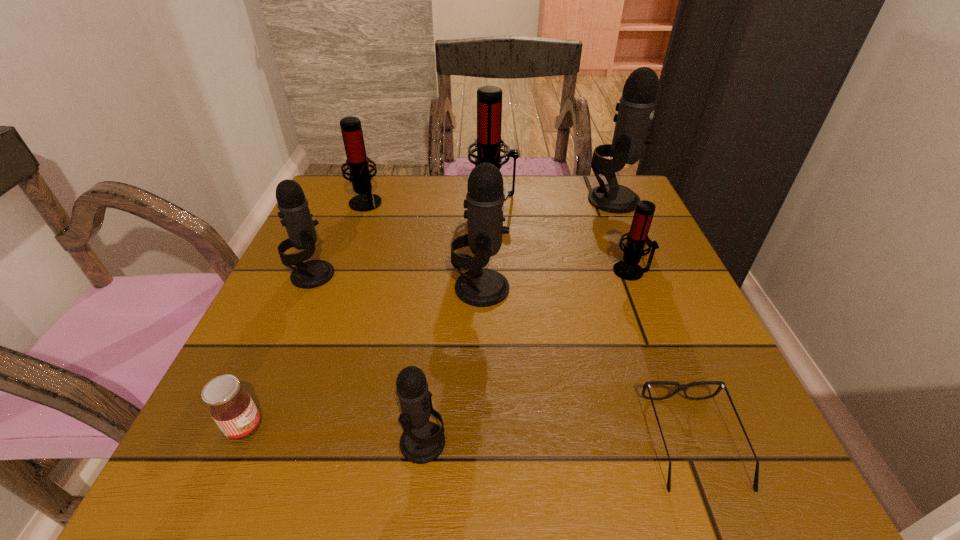
Where is `the closest red microphone to the spectacles`? The width and height of the screenshot is (960, 540). the closest red microphone to the spectacles is located at coordinates (628, 269).

You are a GUI agent. You are given a task and a screenshot of the screen. Output one action in this format:
    pyautogui.click(x=<x>, y=<y>)
    Task: Click on the red microphone that stands as the closest to the biggest black microphone
    
    Given the screenshot: What is the action you would take?
    pyautogui.click(x=489, y=98)

The image size is (960, 540). I want to click on free space that satisfies the following two spatial constraints: 1. on the front side of the second biggest black microphone; 2. on the label side of the second shortest object, so click(x=481, y=427).

The width and height of the screenshot is (960, 540). I want to click on vacant region that satisfies the following two spatial constraints: 1. on the back side of the nearest black microphone; 2. on the right side of the tallest object, so (448, 200).

Where is `free spot that satisfies the following two spatial constraints: 1. on the front side of the second red microphone from right to left; 2. on the label side of the second shortest object`? free spot that satisfies the following two spatial constraints: 1. on the front side of the second red microphone from right to left; 2. on the label side of the second shortest object is located at coordinates (502, 427).

The width and height of the screenshot is (960, 540). Find the location of `free point that satisfies the following two spatial constraints: 1. on the back side of the second red microphone from left to right; 2. on the left side of the second smallest black microphone`. free point that satisfies the following two spatial constraints: 1. on the back side of the second red microphone from left to right; 2. on the left side of the second smallest black microphone is located at coordinates (348, 194).